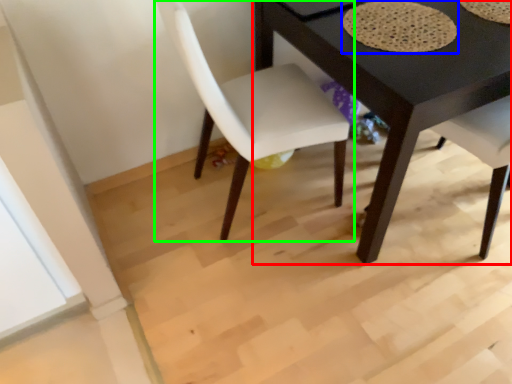
Question: Estimate the real-world distances between objects in this image. Which object is closer to table (highlighted by a red box), mat (highlighted by a blue box) or chair (highlighted by a green box)?

Choices:
 (A) mat
 (B) chair

Answer: (A)